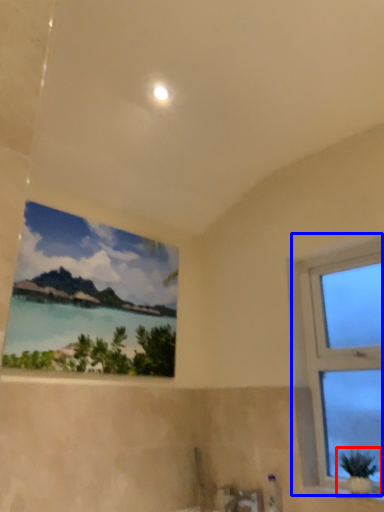
Question: Which object is further to the camera taking this photo, houseplant (highlighted by a red box) or window (highlighted by a blue box)?

Choices:
 (A) houseplant
 (B) window

Answer: (B)